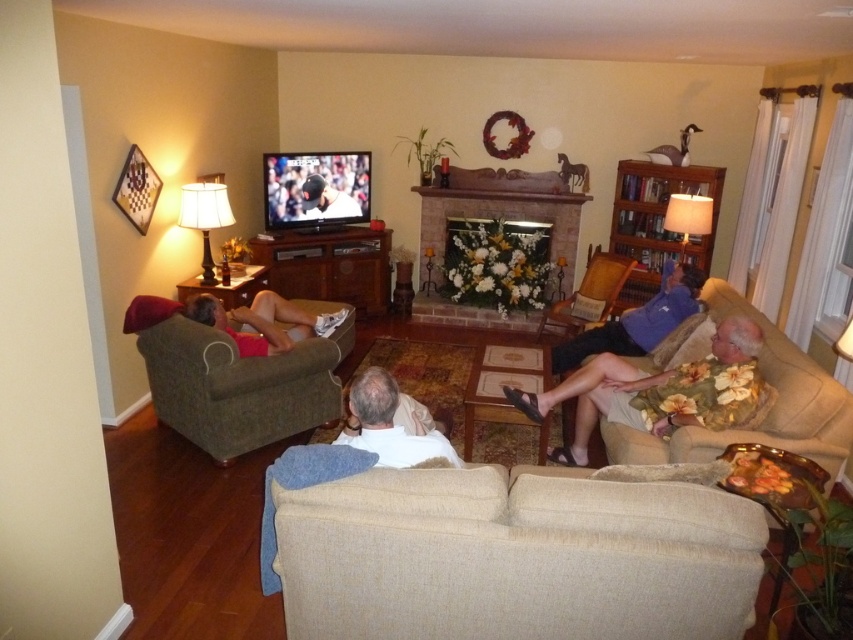
Who is positioned more to the right, brick fireplace at center or brown wooden armchair at center?

brown wooden armchair at center is more to the right.

Measure the distance between brick fireplace at center and camera.

brick fireplace at center and camera are 6.28 meters apart from each other.

I want to click on brick fireplace at center, so click(x=495, y=218).

Consider the image. Between white fabric couch at center and blue cotton shirt at right, which one has less height?

With less height is white fabric couch at center.

In order to click on white fabric couch at center in this screenshot , I will do `click(392, 422)`.

Which is in front, point (372, 451) or point (651, 333)?

Point (372, 451) is in front.

Image resolution: width=853 pixels, height=640 pixels. In order to click on white fabric couch at center in this screenshot , I will do `click(392, 422)`.

Is point (744, 392) closer to viewer compared to point (795, 380)?

No, it is not.

The image size is (853, 640). Describe the element at coordinates (659, 392) in the screenshot. I see `floral print dress at right` at that location.

This screenshot has height=640, width=853. Find the location of `floral print dress at right`. floral print dress at right is located at coordinates (659, 392).